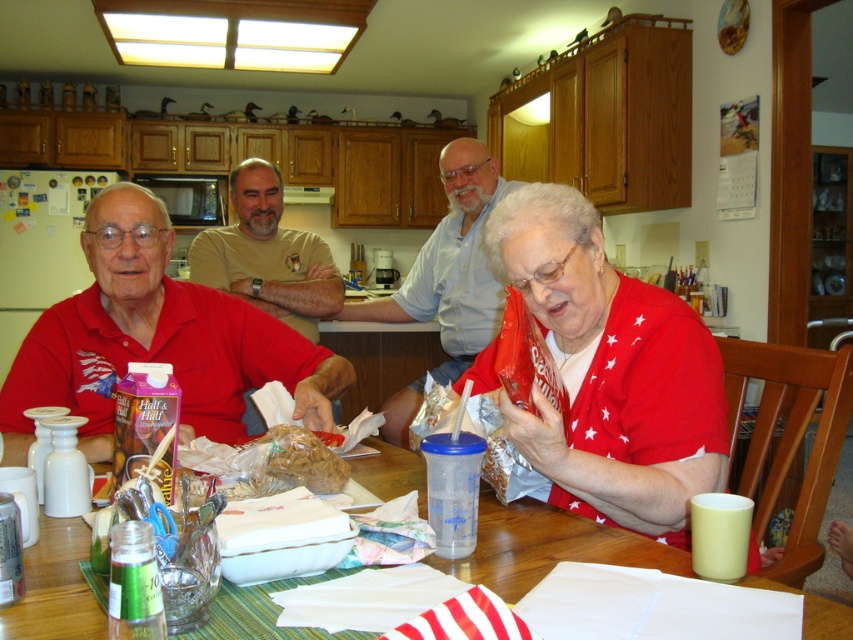
Who is positioned more to the left, wooden table at center or light blue button-down shirt at center?

From the viewer's perspective, light blue button-down shirt at center appears more on the left side.

The image size is (853, 640). I want to click on wooden table at center, so click(x=547, y=547).

Where is `wooden table at center`? The height and width of the screenshot is (640, 853). wooden table at center is located at coordinates (547, 547).

Which is in front, point (621, 410) or point (233, 198)?

Point (621, 410) is in front.

Can you confirm if matte red sweater at center is wider than brown cotton t-shirt at center?

No.

Where is `matte red sweater at center`? The image size is (853, 640). matte red sweater at center is located at coordinates (607, 372).

Locate an element on the screen. matte red sweater at center is located at coordinates (607, 372).

Can you confirm if red cotton shirt at left is taller than brown cotton t-shirt at center?

No, red cotton shirt at left is not taller than brown cotton t-shirt at center.

Is point (90, 440) closer to camera compared to point (289, 278)?

Yes.

Find the location of `red cotton shirt at left`. red cotton shirt at left is located at coordinates (155, 340).